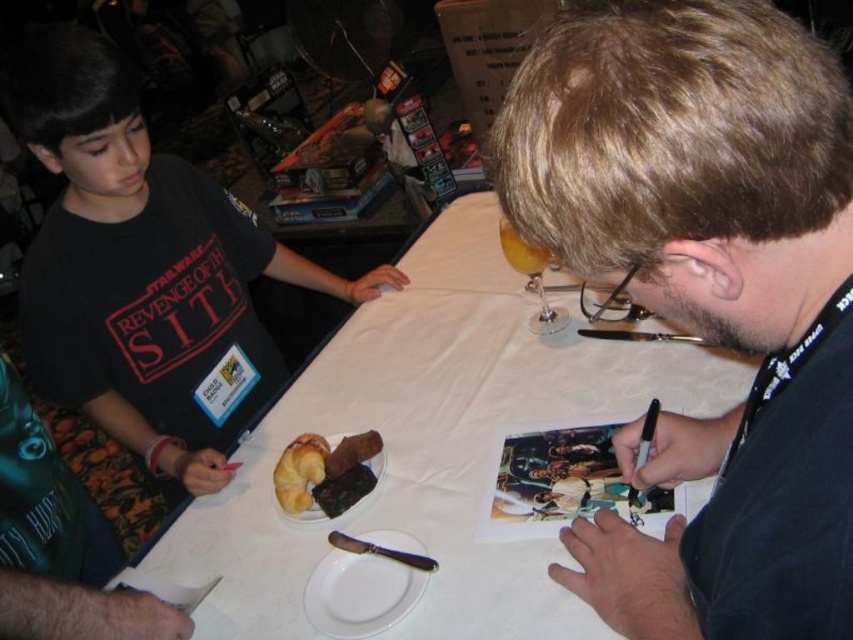
Question: Does black matte pen at center have a greater width compared to golden brown croissant at center?

Choices:
 (A) no
 (B) yes

Answer: (B)

Question: Which of the following is the closest to the observer?

Choices:
 (A) white paper at center
 (B) matte black t-shirt at left

Answer: (A)

Question: From the image, what is the correct spatial relationship of white paper at center in relation to golden brown croissant at center?

Choices:
 (A) below
 (B) above

Answer: (B)

Question: Is white paper at center further to camera compared to matte black t-shirt at left?

Choices:
 (A) yes
 (B) no

Answer: (B)

Question: Which point is farther to the camera?

Choices:
 (A) black matte pen at center
 (B) white paper at center
 (C) matte black t-shirt at left
 (D) golden brown croissant at center

Answer: (C)

Question: Which object is farther from the camera taking this photo?

Choices:
 (A) white paper at center
 (B) matte black t-shirt at left
 (C) golden brown croissant at center
 (D) black matte pen at center

Answer: (B)